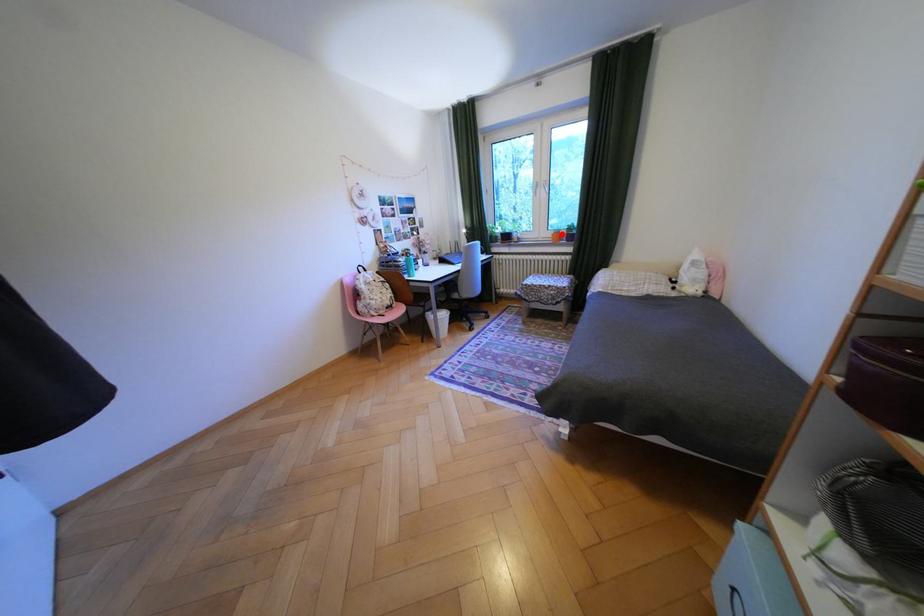
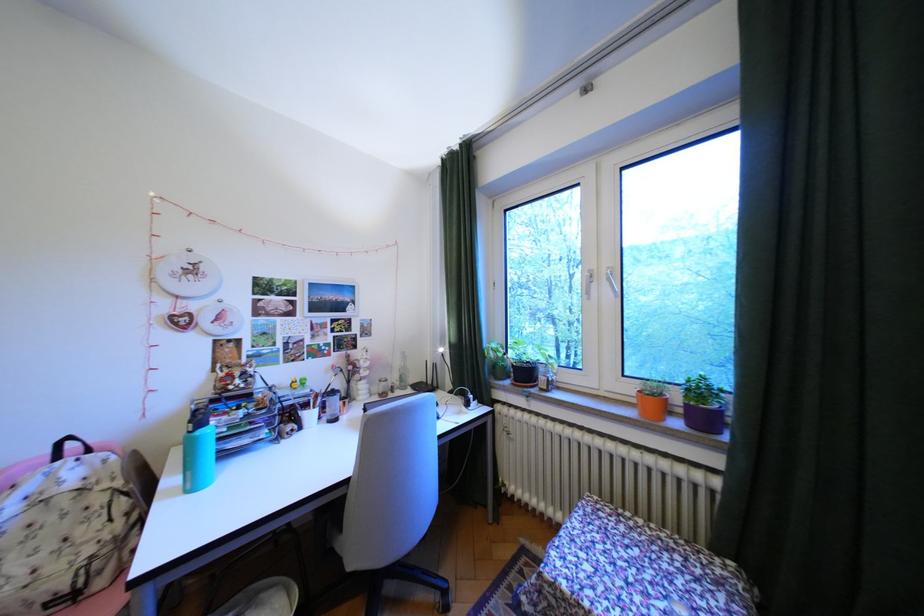
Question: I am providing you with two images of the same scene from different viewpoints. A red point is shown in image1. For the corresponding object point in image2, is it positioned nearer or farther from the camera?

Choices:
 (A) Nearer
 (B) Farther

Answer: (B)